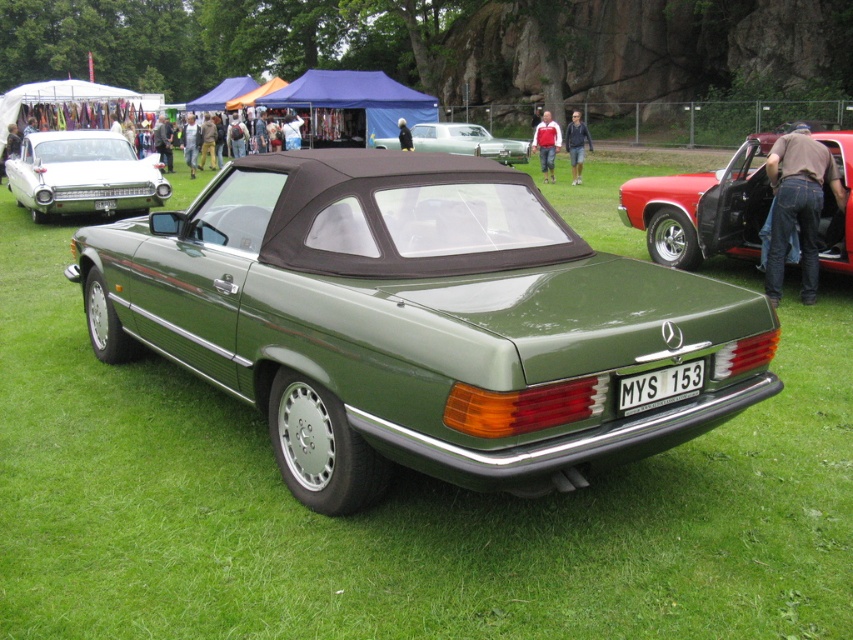
Measure the distance between shiny red car at right and camera.

They are 9.06 meters apart.

Find the location of a particular element. shiny red car at right is located at coordinates (700, 211).

Describe the element at coordinates (700, 211) in the screenshot. I see `shiny red car at right` at that location.

Where is `shiny red car at right`? This screenshot has height=640, width=853. shiny red car at right is located at coordinates (700, 211).

Is green glossy convertible at center shorter than white plastic license plate at center?

No.

Is point (317, 216) farther from viewer compared to point (672, 390)?

Yes.

The image size is (853, 640). What do you see at coordinates (416, 321) in the screenshot? I see `green glossy convertible at center` at bounding box center [416, 321].

Locate an element on the screen. The image size is (853, 640). green glossy convertible at center is located at coordinates coord(416,321).

Does green glossy convertible at center have a lesser width compared to green matte convertible at center?

Yes.

Between green glossy convertible at center and green matte convertible at center, which one appears on the right side from the viewer's perspective?

Positioned to the right is green matte convertible at center.

At what (x,y) coordinates should I click in order to perform the action: click on green glossy convertible at center. Please return your answer as a coordinate pair (x, y). This screenshot has width=853, height=640. Looking at the image, I should click on (416, 321).